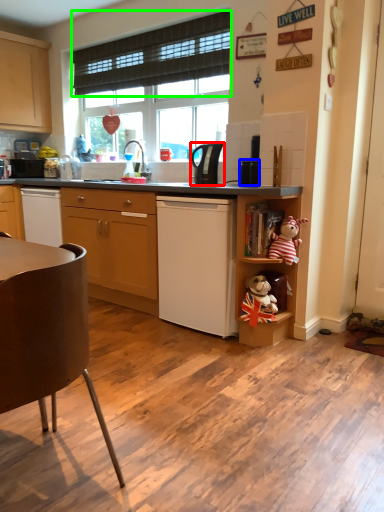
Question: Which is nearer to the kitchen appliance (highlighted by a red box)? appliance (highlighted by a blue box) or curtain (highlighted by a green box).

Choices:
 (A) appliance
 (B) curtain

Answer: (A)